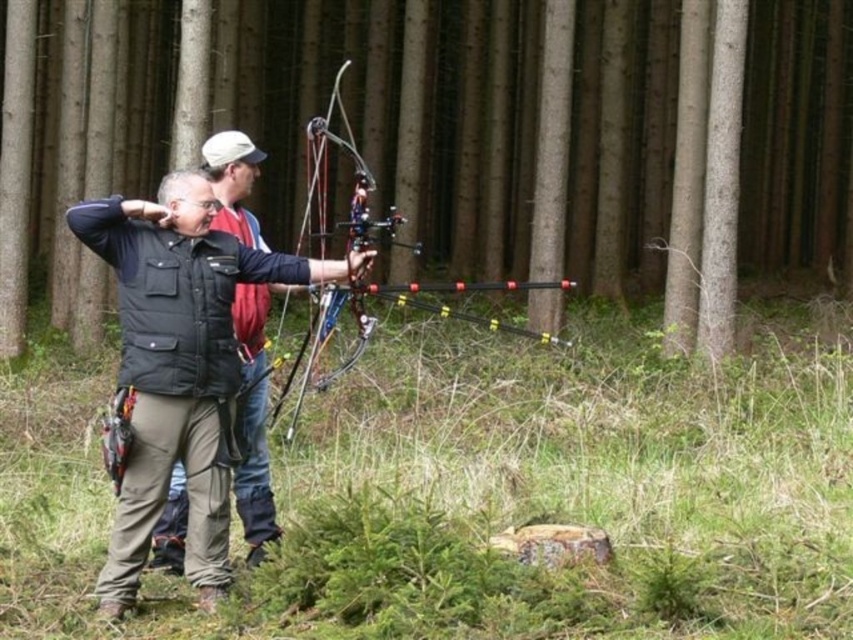
Question: Considering the relative positions of brown wood tree at center and black matte vest at center in the image provided, where is brown wood tree at center located with respect to black matte vest at center?

Choices:
 (A) above
 (B) below

Answer: (A)

Question: Which of the following is the farthest from the observer?

Choices:
 (A) black matte vest at center
 (B) metallic black bow at center
 (C) matte black jacket at center

Answer: (A)

Question: Among these objects, which one is nearest to the camera?

Choices:
 (A) brown wood tree at center
 (B) black matte vest at center
 (C) metallic black bow at center

Answer: (C)

Question: Can you confirm if brown wood tree at center is positioned to the right of matte black jacket at center?

Choices:
 (A) no
 (B) yes

Answer: (B)

Question: Is matte black jacket at center to the right of black matte vest at center from the viewer's perspective?

Choices:
 (A) yes
 (B) no

Answer: (B)

Question: Which point is closer to the camera?

Choices:
 (A) (138, 397)
 (B) (323, 321)
 (C) (515, 104)
 (D) (260, 512)

Answer: (A)